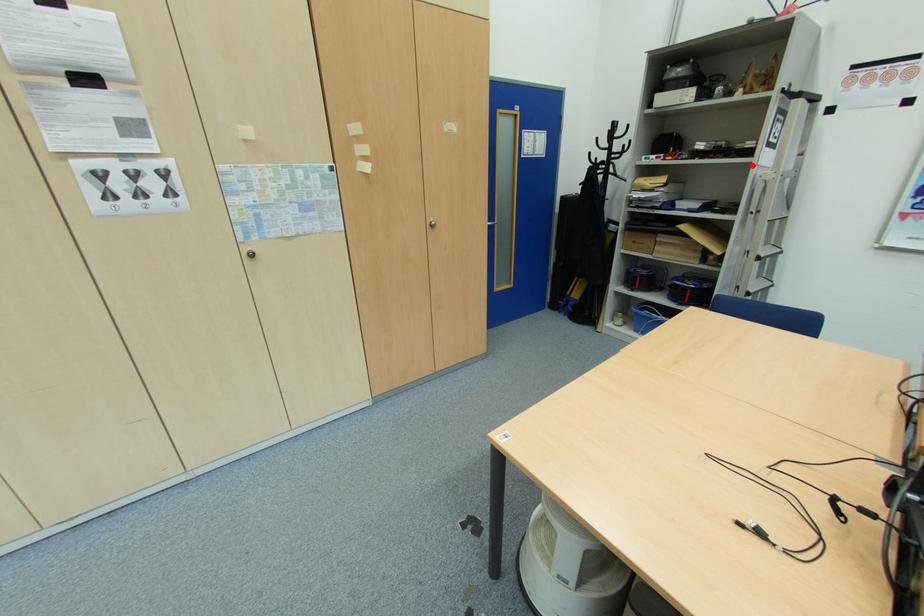
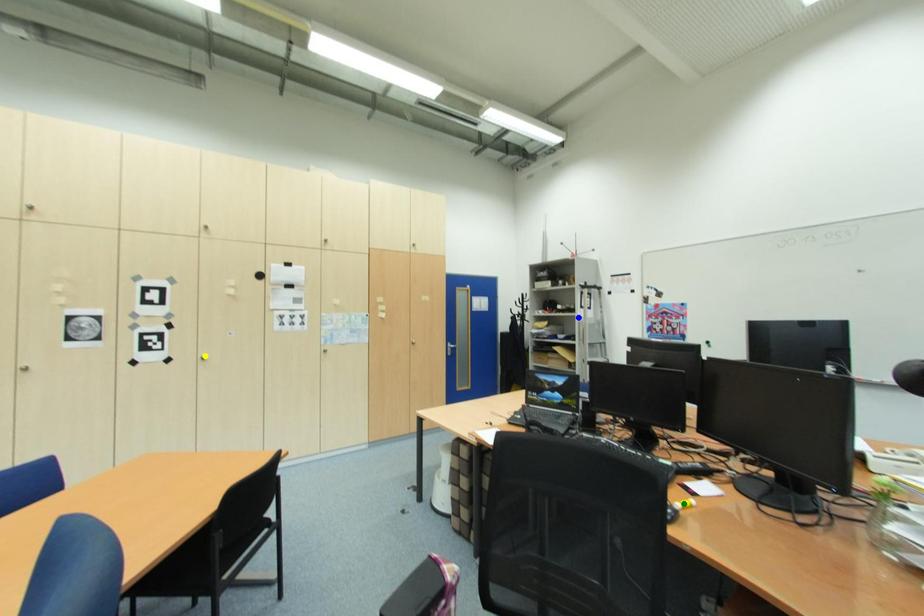
Question: I am providing you with two images of the same scene from different viewpoints. A red point is marked on the first image. You are given multiple points on the second image. Which mark in image 2 goes with the point in image 1?

Choices:
 (A) blue point
 (B) yellow point
 (C) green point

Answer: (A)